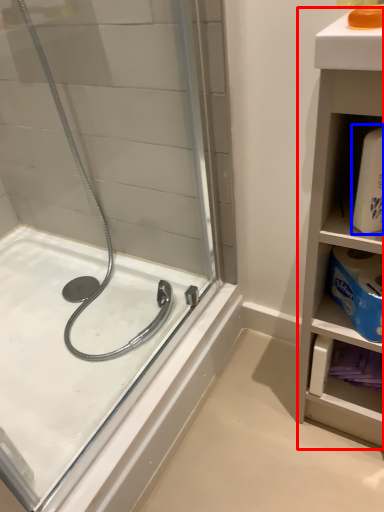
Question: Which object is further to the camera taking this photo, bathroom cabinet (highlighted by a red box) or cleaning product (highlighted by a blue box)?

Choices:
 (A) bathroom cabinet
 (B) cleaning product

Answer: (B)